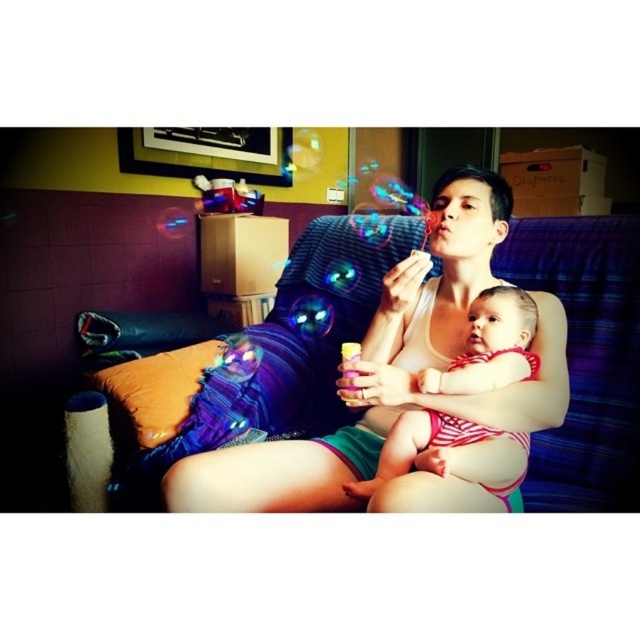
Is matte white tank top at center to the left of striped fabric baby at center from the viewer's perspective?

Yes, matte white tank top at center is to the left of striped fabric baby at center.

Between matte white tank top at center and striped fabric baby at center, which one has less height?

Standing shorter between the two is striped fabric baby at center.

Find the location of a particular element. matte white tank top at center is located at coordinates (403, 387).

The image size is (640, 640). I want to click on matte white tank top at center, so pyautogui.click(x=403, y=387).